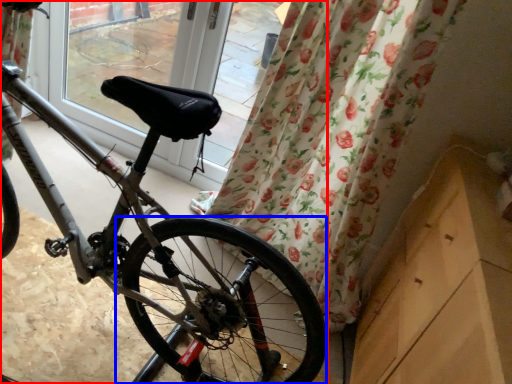
Question: Which point is closer to the camera, bicycle (highlighted by a red box) or wheel (highlighted by a blue box)?

Choices:
 (A) bicycle
 (B) wheel

Answer: (A)